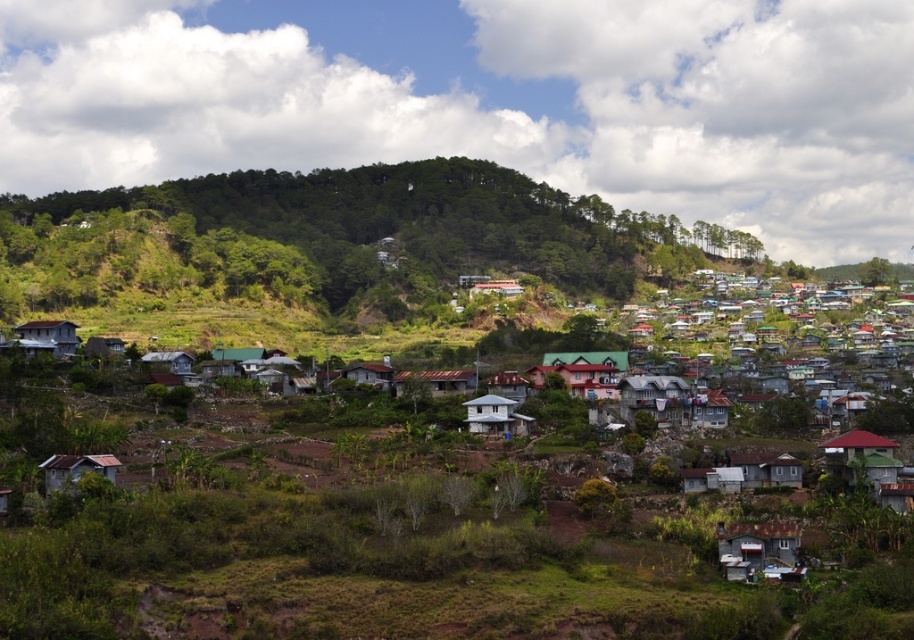
Does green matte house at lower right come behind wooden shingle hut at lower left?

No, it is in front of wooden shingle hut at lower left.

Is green matte house at lower right wider than wooden shingle hut at lower left?

No.

Find the location of a particular element. This screenshot has height=640, width=914. green matte house at lower right is located at coordinates (861, 458).

What are the coordinates of `green matte house at lower right` in the screenshot? It's located at (861, 458).

Is point (496, 424) positioned before point (163, 360)?

Yes, it is in front of point (163, 360).

Which of these two, white matte house at center or light blue wooden hut at center, stands shorter?

light blue wooden hut at center is shorter.

Is point (509, 412) positioned behind point (147, 356)?

No, (509, 412) is closer to viewer.

Locate an element on the screen. white matte house at center is located at coordinates (495, 417).

Between point (99, 468) and point (355, 364), which one is positioned behind?

The point (355, 364) is behind.

Does rustic wood hut at lower left have a smaller size compared to brown corrugated metal hut at center?

Yes.

Is point (70, 465) positioned in front of point (370, 381)?

Yes.

At what (x,y) coordinates should I click in order to perform the action: click on rustic wood hut at lower left. Please return your answer as a coordinate pair (x, y). Looking at the image, I should click on (75, 468).